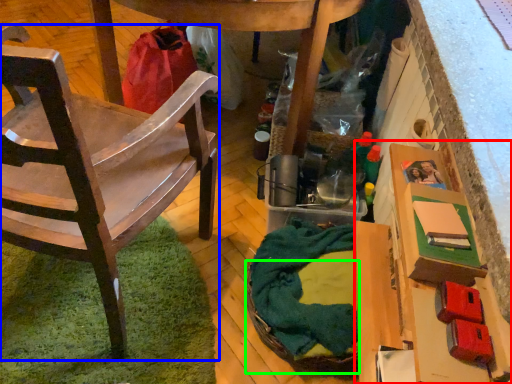
Question: Which is farther away from cardboard box (highlighted by a red box)? chair (highlighted by a blue box) or basket (highlighted by a green box)?

Choices:
 (A) chair
 (B) basket

Answer: (A)